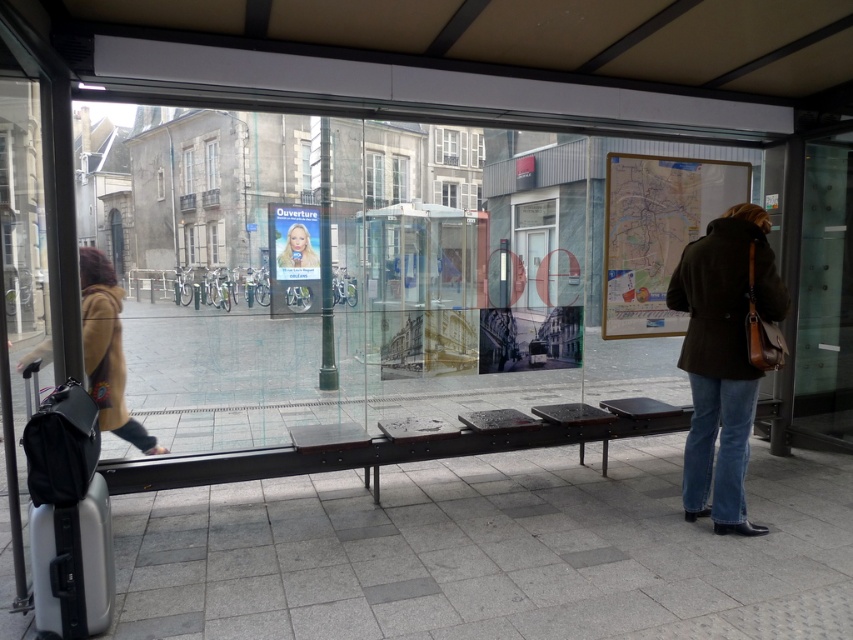
You are waiting at the bus stop and need to check the map on the board. The transparent glass door at right and the brown woolen coat at left are in your way. Which object should you move to get a better view of the map?

You should move the transparent glass door at right because it occupies less space than the brown woolen coat at left, making it easier to move out of the way for a clearer view of the map.

You are at the bus stop and want to check the map. The transparent glass door at right is blocking your view. Can you move to the left of the blonde hair at center to see the map better?

The transparent glass door at right might be wider than blonde hair at center, so moving to the left of the blonde hair at center may not be possible if the door is wider and obstructs that path.

You are at the bus stop and need to exit through the transparent glass door at right. You are wearing the brown woolen coat at left. Can you exit without bending down?

The transparent glass door at right is much taller than the brown woolen coat at left, so you can exit without bending down.